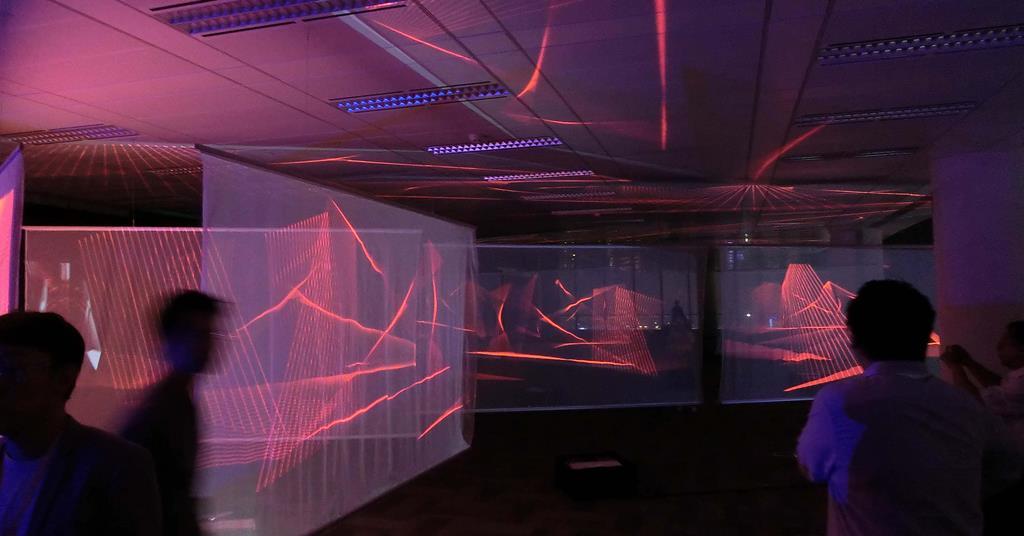
Where is `ceiling`? The width and height of the screenshot is (1024, 536). ceiling is located at coordinates (721, 68).